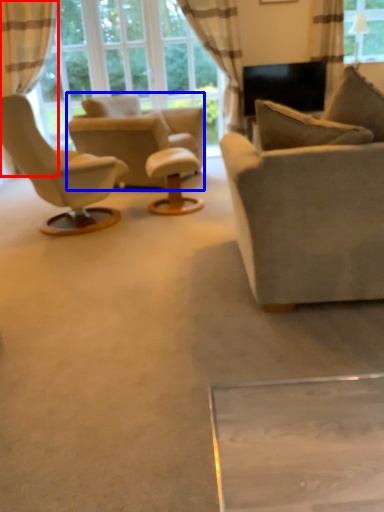
Question: Which object is further to the camera taking this photo, curtain (highlighted by a red box) or chair (highlighted by a blue box)?

Choices:
 (A) curtain
 (B) chair

Answer: (A)